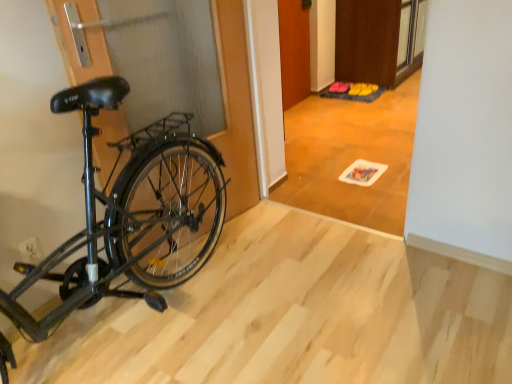
Question: Is wooden door at center, the second door when ordered from right to left, to the left or to the right of wooden tile floor at center in the image?

Choices:
 (A) left
 (B) right

Answer: (A)

Question: In terms of height, does wooden door at center, which is the first door in left-to-right order, look taller or shorter compared to wooden tile floor at center?

Choices:
 (A) short
 (B) tall

Answer: (A)

Question: Which object is the farthest from the white plastic power plug at lower left?

Choices:
 (A) black matte bicycle at left
 (B) wooden door at center, which is the first door in left-to-right order
 (C) yellow fabric shoe at center, arranged as the second walking shoe when viewed from the right
 (D) yellow fabric walking shoe at center, the 2th walking shoe viewed from the left
 (E) wooden tile floor at center

Answer: (D)

Question: Based on their relative distances, which object is nearer to the yellow fabric shoe at center, placed as the first walking shoe when sorted from left to right?

Choices:
 (A) black matte bicycle at left
 (B) yellow fabric walking shoe at center, the 2th walking shoe viewed from the left
 (C) wooden door at center, which is the first door in left-to-right order
 (D) white plastic power plug at lower left
 (E) brown matte door at upper center, placed as the second door when sorted from left to right

Answer: (B)